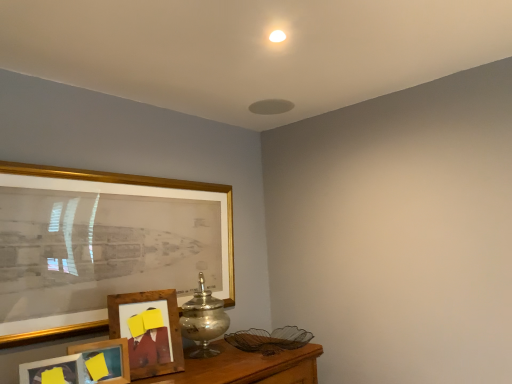
Describe the element at coordinates (54, 371) in the screenshot. This screenshot has width=512, height=384. I see `wooden photo frame at lower left, marked as the 1th picture frame in a front-to-back arrangement` at that location.

Where is `wooden photo frame at lower left, marked as the 1th picture frame in a front-to-back arrangement`? This screenshot has height=384, width=512. wooden photo frame at lower left, marked as the 1th picture frame in a front-to-back arrangement is located at coordinates (54, 371).

Locate an element on the screen. wooden photo frame at lower left, which is counted as the fourth picture frame, starting from the back is located at coordinates tap(54, 371).

Looking at this image, considering the relative sizes of wooden photo frame at lower left, marked as the 1th picture frame in a front-to-back arrangement, and wooden photo frame at lower left, the second picture frame from the front, in the image provided, is wooden photo frame at lower left, marked as the 1th picture frame in a front-to-back arrangement, wider than wooden photo frame at lower left, the second picture frame from the front,?

In fact, wooden photo frame at lower left, marked as the 1th picture frame in a front-to-back arrangement, might be narrower than wooden photo frame at lower left, the second picture frame from the front.

Considering the positions of points (75, 367) and (125, 345), is point (75, 367) farther from camera compared to point (125, 345)?

No, it is not.

Is wooden photo frame at lower left, which is counted as the fourth picture frame, starting from the back, facing towards wooden photo frame at lower left, the third picture frame viewed from the back?

No.

Between wooden photo frame at lower left, marked as the 1th picture frame in a front-to-back arrangement, and wooden photo frame at lower left, the second picture frame from the front, which one has smaller size?

wooden photo frame at lower left, marked as the 1th picture frame in a front-to-back arrangement.

Based on their sizes in the image, would you say silver metallic vase at center is bigger or smaller than gold framed picture at left, the second picture frame in the back-to-front sequence?

Considering their sizes, silver metallic vase at center takes up less space than gold framed picture at left, the second picture frame in the back-to-front sequence.

Identify the location of table lamp that is below the gold framed picture at left, which is the third picture frame from front to back (from the image's perspective). Image resolution: width=512 pixels, height=384 pixels. (203, 320).

Does point (192, 315) appear closer or farther from the camera than point (62, 168)?

Point (192, 315) is positioned farther from the camera compared to point (62, 168).

Can you confirm if wooden photo frame at lower left, the third picture frame viewed from the back, is shorter than gold framed picture at left, which is the third picture frame from front to back?

Correct, wooden photo frame at lower left, the third picture frame viewed from the back, is not as tall as gold framed picture at left, which is the third picture frame from front to back.

Is wooden photo frame at lower left, the second picture frame from the front, facing towards gold framed picture at left, which is the third picture frame from front to back?

No, wooden photo frame at lower left, the second picture frame from the front, is not facing towards gold framed picture at left, which is the third picture frame from front to back.

From the image's perspective, is wooden photo frame at lower left, the third picture frame viewed from the back, located beneath gold framed picture at left, the second picture frame in the back-to-front sequence?

Indeed, from the image's perspective, wooden photo frame at lower left, the third picture frame viewed from the back, is shown beneath gold framed picture at left, the second picture frame in the back-to-front sequence.

Considering the sizes of objects wooden photo frame at lower left, the second picture frame from the front, and gold framed picture at left, the second picture frame in the back-to-front sequence, in the image provided, who is smaller, wooden photo frame at lower left, the second picture frame from the front, or gold framed picture at left, the second picture frame in the back-to-front sequence,?

wooden photo frame at lower left, the second picture frame from the front.

Does wooden photo frame at lower left, the second picture frame from the front, have a larger size compared to wooden photo frame at lower left, which is counted as the fourth picture frame, starting from the back?

Yes, wooden photo frame at lower left, the second picture frame from the front, is bigger than wooden photo frame at lower left, which is counted as the fourth picture frame, starting from the back.

Is the surface of wooden photo frame at lower left, the third picture frame viewed from the back, in direct contact with wooden photo frame at lower left, marked as the 1th picture frame in a front-to-back arrangement?

Yes, the surface of wooden photo frame at lower left, the third picture frame viewed from the back, is in contact with wooden photo frame at lower left, marked as the 1th picture frame in a front-to-back arrangement.

Which is less distant, (x=85, y=362) or (x=68, y=359)?

The point (x=68, y=359) is in front.

Who is taller, wooden photo frame at lower left, the second picture frame from the front, or wooden photo frame at lower left, marked as the 1th picture frame in a front-to-back arrangement?

With more height is wooden photo frame at lower left, the second picture frame from the front.

Is point (141, 351) more distant than point (116, 360)?

Yes, it is.

Is wooden picture frame at lower left, positioned as the fourth picture frame in front-to-back order, taller or shorter than wooden photo frame at lower left, the third picture frame viewed from the back?

Considering their sizes, wooden picture frame at lower left, positioned as the fourth picture frame in front-to-back order, has more height than wooden photo frame at lower left, the third picture frame viewed from the back.

Looking at this image, can you tell me how much wooden picture frame at lower left, positioned as the fourth picture frame in front-to-back order, and wooden photo frame at lower left, the third picture frame viewed from the back, differ in facing direction?

9.17 degrees.

Is wooden picture frame at lower left, which appears as the 1th picture frame when viewed from the back, next to wooden photo frame at lower left, the second picture frame from the front, and touching it?

No.

Is wooden photo frame at lower left, which is counted as the fourth picture frame, starting from the back, not close to gold framed picture at left, the second picture frame in the back-to-front sequence?

Actually, wooden photo frame at lower left, which is counted as the fourth picture frame, starting from the back, and gold framed picture at left, the second picture frame in the back-to-front sequence, are a little close together.

Considering the relative positions of wooden photo frame at lower left, which is counted as the fourth picture frame, starting from the back, and gold framed picture at left, which is the third picture frame from front to back, in the image provided, is wooden photo frame at lower left, which is counted as the fourth picture frame, starting from the back, to the left of gold framed picture at left, which is the third picture frame from front to back, from the viewer's perspective?

Yes.

Is wooden photo frame at lower left, which is counted as the fourth picture frame, starting from the back, looking in the opposite direction of wooden picture frame at lower left, positioned as the fourth picture frame in front-to-back order?

No, wooden photo frame at lower left, which is counted as the fourth picture frame, starting from the back,'s orientation is not away from wooden picture frame at lower left, positioned as the fourth picture frame in front-to-back order.

What's the angular difference between wooden photo frame at lower left, which is counted as the fourth picture frame, starting from the back, and wooden picture frame at lower left, which appears as the 1th picture frame when viewed from the back,'s facing directions?

wooden photo frame at lower left, which is counted as the fourth picture frame, starting from the back, and wooden picture frame at lower left, which appears as the 1th picture frame when viewed from the back, are facing 9.17 degrees away from each other.

Is point (24, 369) positioned in front of point (135, 374)?

Yes.

Is wooden photo frame at lower left, which is counted as the fourth picture frame, starting from the back, positioned beyond the bounds of wooden picture frame at lower left, positioned as the fourth picture frame in front-to-back order?

That's correct, wooden photo frame at lower left, which is counted as the fourth picture frame, starting from the back, is outside of wooden picture frame at lower left, positioned as the fourth picture frame in front-to-back order.

From the wooden photo frame at lower left, marked as the 1th picture frame in a front-to-back arrangement, count 1st picture frame to the right and point to it. Please provide its 2D coordinates.

[(106, 360)]

Identify the location of table lamp behind the gold framed picture at left, which is the third picture frame from front to back. (203, 320).

From the image, which object appears to be nearer to wooden photo frame at lower left, the second picture frame from the front, wooden picture frame at lower left, which appears as the 1th picture frame when viewed from the back, or gold framed picture at left, which is the third picture frame from front to back?

wooden picture frame at lower left, which appears as the 1th picture frame when viewed from the back.

From the image, which object appears to be nearer to wooden photo frame at lower left, the third picture frame viewed from the back, wooden photo frame at lower left, marked as the 1th picture frame in a front-to-back arrangement, or silver metallic vase at center?

wooden photo frame at lower left, marked as the 1th picture frame in a front-to-back arrangement, lies closer to wooden photo frame at lower left, the third picture frame viewed from the back, than the other object.

Looking at the image, which one is located closer to wooden photo frame at lower left, the third picture frame viewed from the back, gold framed picture at left, which is the third picture frame from front to back, or wooden picture frame at lower left, which appears as the 1th picture frame when viewed from the back?

Based on the image, wooden picture frame at lower left, which appears as the 1th picture frame when viewed from the back, appears to be nearer to wooden photo frame at lower left, the third picture frame viewed from the back.

Estimate the real-world distances between objects in this image. Which object is closer to silver metallic vase at center, wooden photo frame at lower left, which is counted as the fourth picture frame, starting from the back, or wooden photo frame at lower left, the second picture frame from the front?

wooden photo frame at lower left, the second picture frame from the front, is positioned closer to the anchor silver metallic vase at center.

Which object lies further to the anchor point silver metallic vase at center, wooden photo frame at lower left, the third picture frame viewed from the back, or wooden picture frame at lower left, positioned as the fourth picture frame in front-to-back order?

wooden photo frame at lower left, the third picture frame viewed from the back.

Based on their spatial positions, is wooden photo frame at lower left, which is counted as the fourth picture frame, starting from the back, or wooden picture frame at lower left, positioned as the fourth picture frame in front-to-back order, closer to silver metallic vase at center?

Among the two, wooden picture frame at lower left, positioned as the fourth picture frame in front-to-back order, is located nearer to silver metallic vase at center.

Considering their positions, is wooden picture frame at lower left, which appears as the 1th picture frame when viewed from the back, positioned further to wooden photo frame at lower left, marked as the 1th picture frame in a front-to-back arrangement, than wooden photo frame at lower left, the second picture frame from the front?

wooden picture frame at lower left, which appears as the 1th picture frame when viewed from the back.

When comparing their distances from gold framed picture at left, the second picture frame in the back-to-front sequence, does wooden photo frame at lower left, the second picture frame from the front, or silver metallic vase at center seem further?

wooden photo frame at lower left, the second picture frame from the front, is further to gold framed picture at left, the second picture frame in the back-to-front sequence.

This screenshot has width=512, height=384. In order to click on picture frame between gold framed picture at left, the second picture frame in the back-to-front sequence, and wooden photo frame at lower left, the third picture frame viewed from the back, in the vertical direction in this screenshot , I will do `click(149, 332)`.

Find the location of a particular element. Image resolution: width=512 pixels, height=384 pixels. picture frame positioned between gold framed picture at left, the second picture frame in the back-to-front sequence, and silver metallic vase at center from near to far is located at coordinates (149, 332).